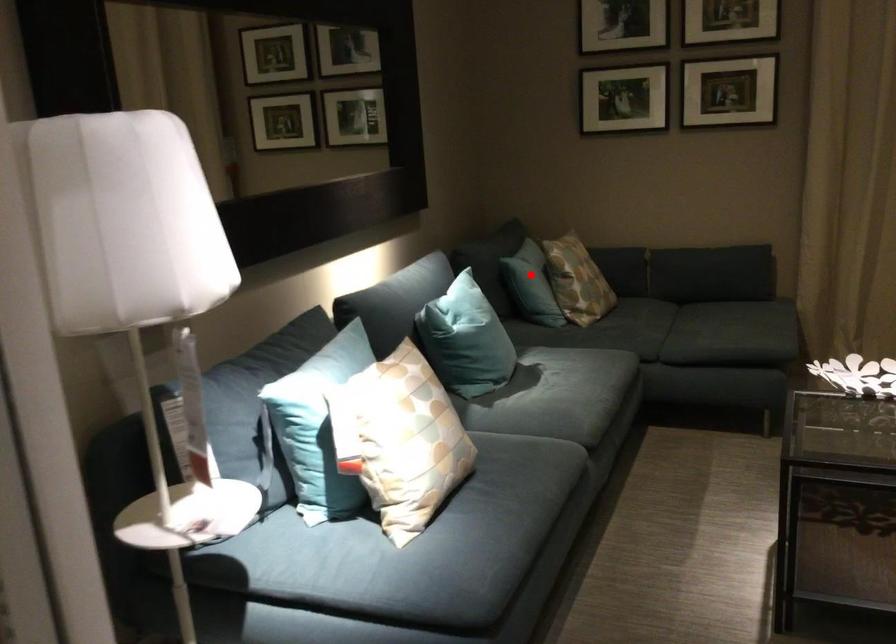
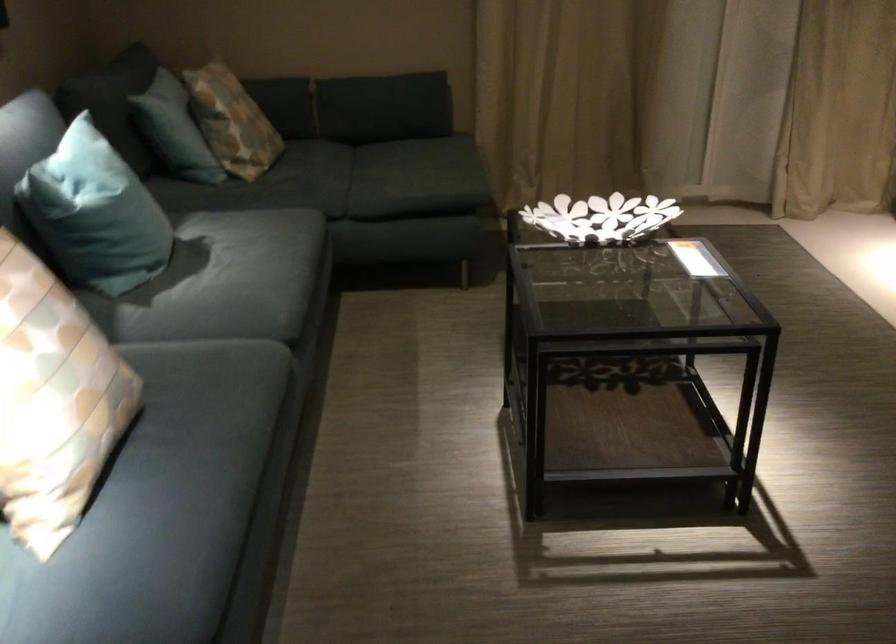
Question: I am providing you with two images of the same scene from different viewpoints. In image1, a red point is highlighted. Considering the same 3D point in image2, which of the following is correct?

Choices:
 (A) It is closer
 (B) It is farther

Answer: (A)